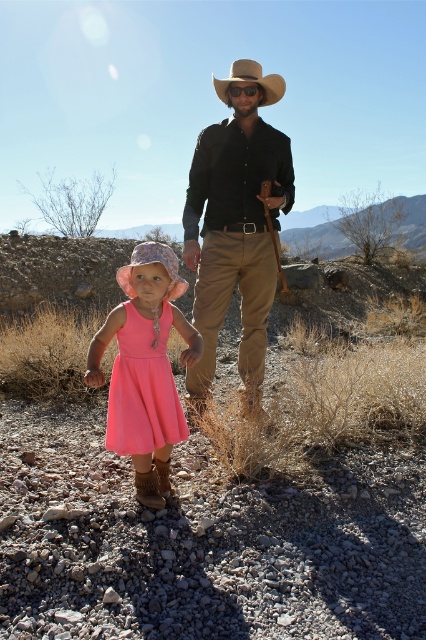
You are a photographer standing at the center of the desert scene. You want to take a photo of the matte black shirt at center and the adult with the gun. How far apart should you position them in the frame to ensure both are in focus?

The matte black shirt at center and the adult with the gun are 3.87 meters apart. To ensure both are in focus, position them at this distance in the frame.

You are a photographer trying to capture the two cowboy hats in the scene. Which direction should you move your camera to frame the pink fabric cowboy hat at center and the brown felt cowboy hat at center properly?

Move your camera to the right to frame the pink fabric cowboy hat at center and the brown felt cowboy hat at center properly, since the pink fabric cowboy hat at center is to the left of the brown felt cowboy hat at center.